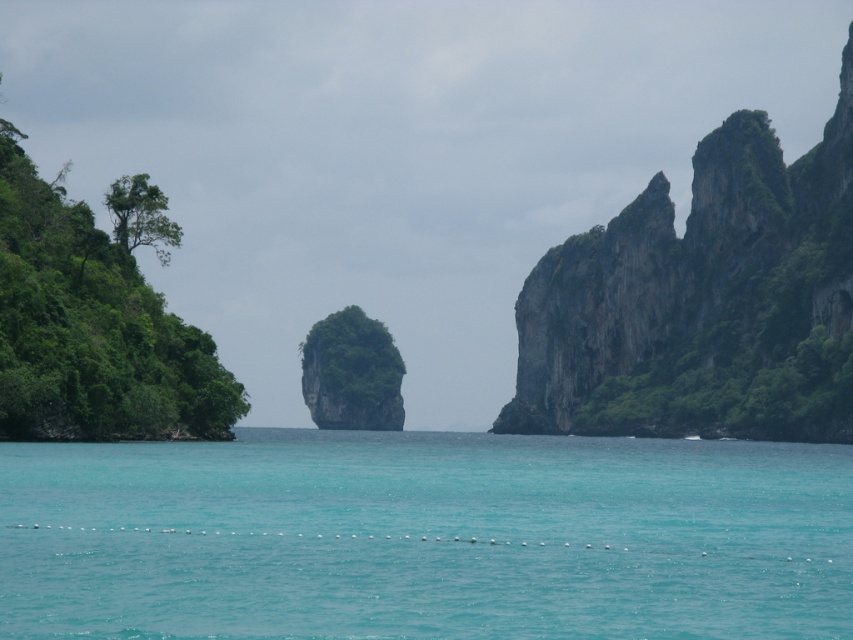
Looking at this image, you are standing at the point marked as point (425, 538) in the image. What type of surface are you currently standing on?

The point (425, 538) is on turquoise water at center, so you are standing on water.

You are a photographer standing at the edge of the cliff on the right side of the image. You want to capture the turquoise water at center in your shot. Based on its position, what coordinates should you aim your camera towards?

The turquoise water at center is located at coordinates point (425, 538), so you should aim your camera towards those coordinates to capture it.

Consider the image. You are a photographer positioned at the left edge of the turquoise water at center. You want to capture a shot of the green mossy rock at right. In which direction should you move your camera to frame the rock?

The turquoise water at center is to the left of green mossy rock at right, so you should move your camera to the right to frame the green mossy rock at right.